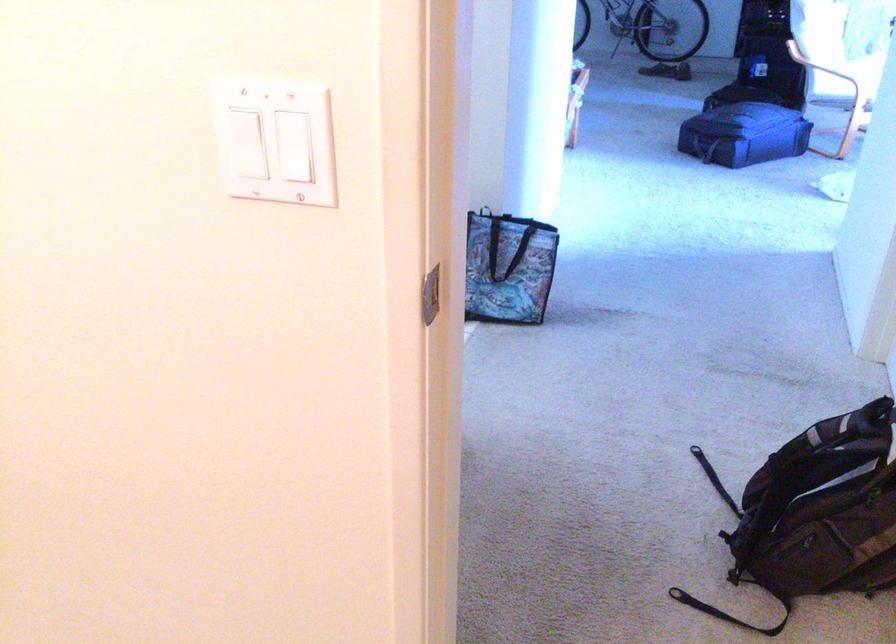
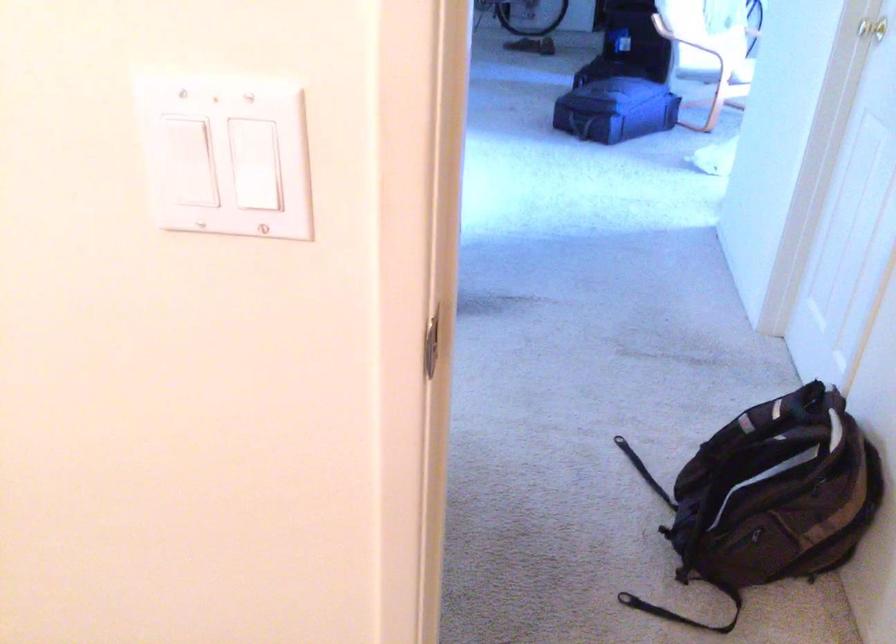
Question: The images are taken continuously from a first-person perspective. In which direction is your viewpoint rotating?

Choices:
 (A) Left
 (B) Right
 (C) Up
 (D) Down

Answer: (B)